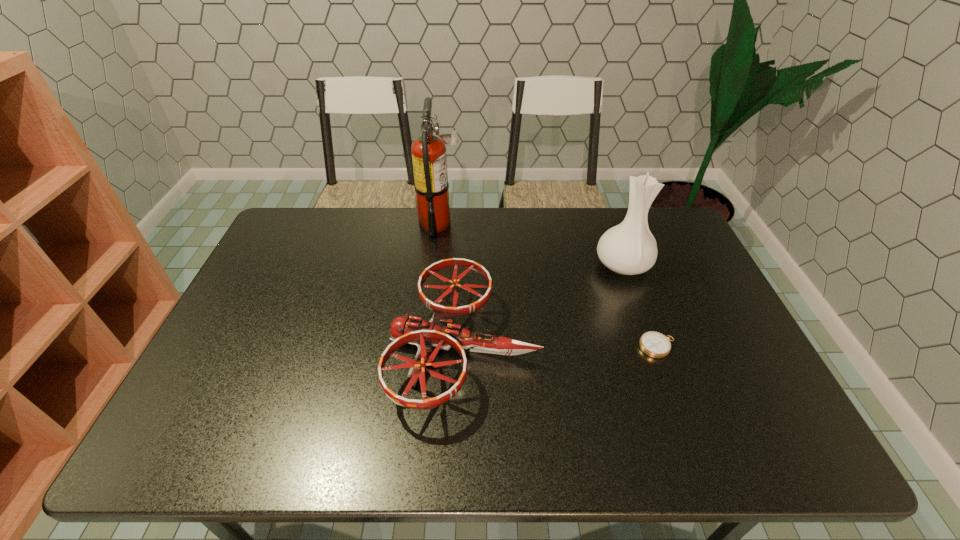
What are the coordinates of `free space that satisfies the following two spatial constraints: 1. from the nozzle of the fire extinguisher; 2. on the right side of the third shortest object` in the screenshot? It's located at (435, 265).

Find the location of `blank area in the image that satisfies the following two spatial constraints: 1. from the nozzle of the drone; 2. on the left side of the tallest object`. blank area in the image that satisfies the following two spatial constraints: 1. from the nozzle of the drone; 2. on the left side of the tallest object is located at coordinates (426, 346).

Find the location of a particular element. The image size is (960, 540). vacant space that satisfies the following two spatial constraints: 1. from the nozzle of the farthest object; 2. on the back side of the second farthest object is located at coordinates (435, 265).

Identify the location of free point that satisfies the following two spatial constraints: 1. from the nozzle of the third nearest object; 2. on the left side of the fire extinguisher. (435, 265).

Where is `vacant space that satisfies the following two spatial constraints: 1. from the nozzle of the third nearest object; 2. on the right side of the fire extinguisher`? The width and height of the screenshot is (960, 540). vacant space that satisfies the following two spatial constraints: 1. from the nozzle of the third nearest object; 2. on the right side of the fire extinguisher is located at coordinates (435, 265).

I want to click on free location that satisfies the following two spatial constraints: 1. from the nozzle of the farthest object; 2. on the right side of the shortest object, so click(x=426, y=347).